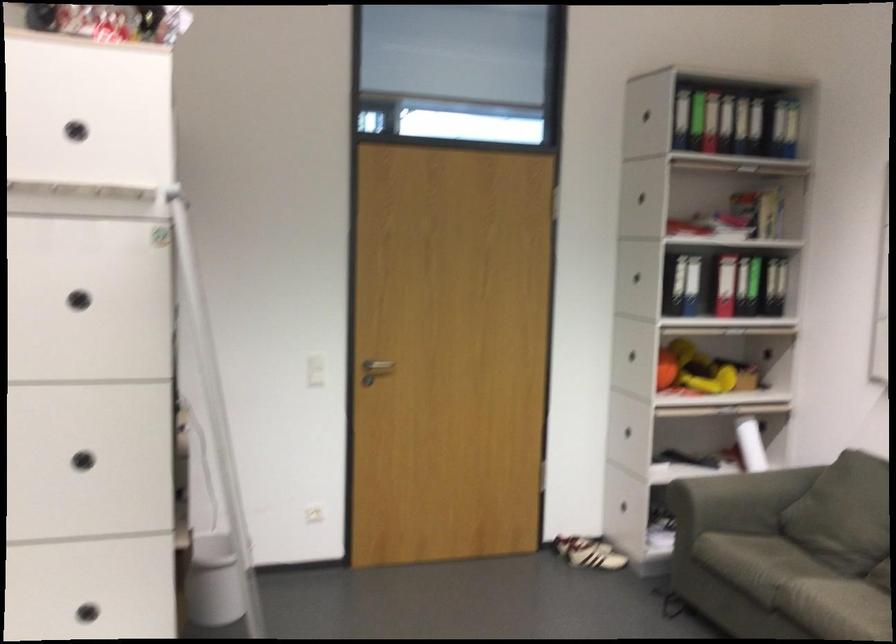
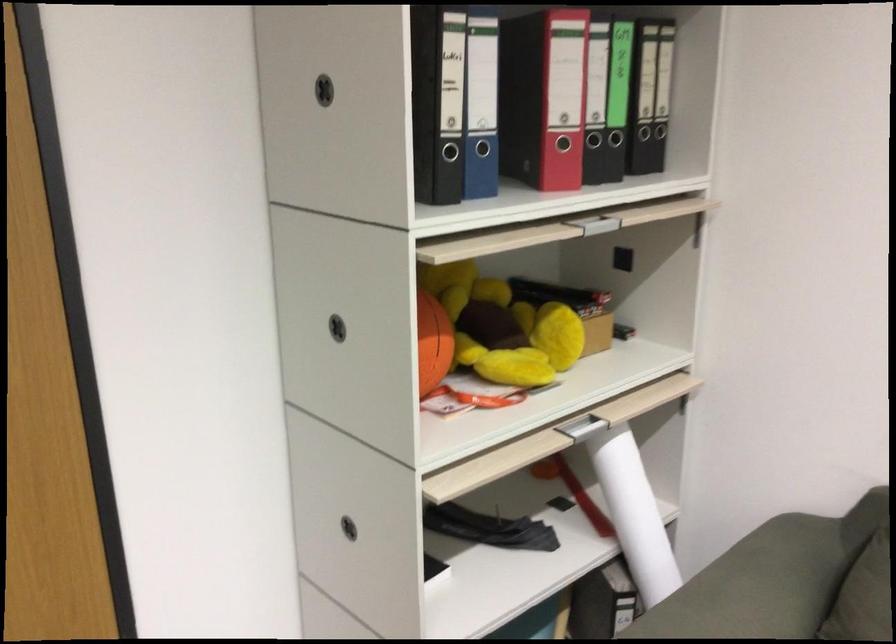
In the second image, find the point that corresponds to (750,453) in the first image.

(633, 514)